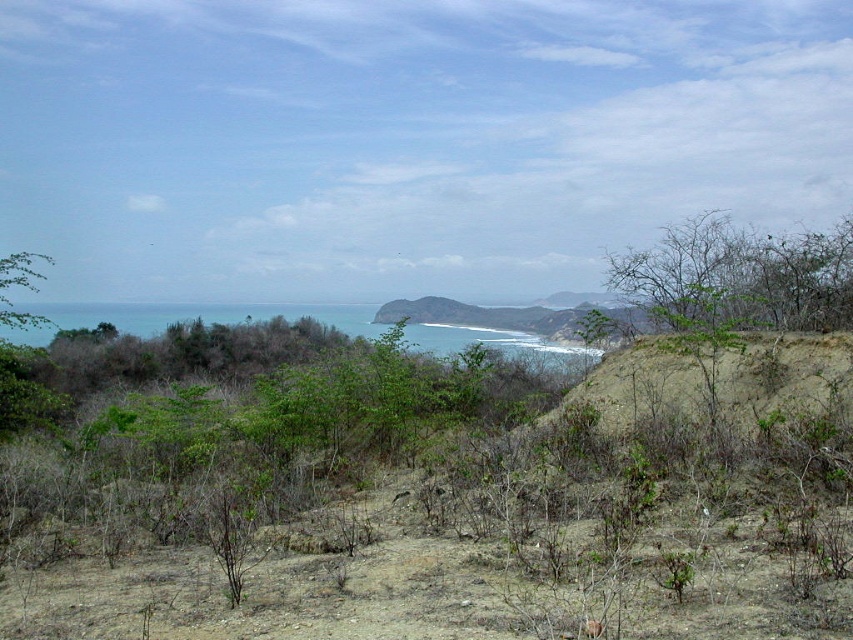
Which is in front, point (143, 333) or point (21, 320)?

Point (21, 320) is in front.

This screenshot has height=640, width=853. What are the coordinates of `blue water at center` in the screenshot? It's located at (189, 317).

You are a GUI agent. You are given a task and a screenshot of the screen. Output one action in this format:
    pyautogui.click(x=<x>, y=<y>)
    Task: Click on the blue water at center
    
    Given the screenshot: What is the action you would take?
    click(189, 317)

Where is `blue water at center`? The width and height of the screenshot is (853, 640). blue water at center is located at coordinates (189, 317).

Measure the distance between point (781,305) and camera.

A distance of 66.78 feet exists between point (781,305) and camera.

Find the location of a particular element. The width and height of the screenshot is (853, 640). green leafy bush at right is located at coordinates (741, 273).

Is green leafy bush at right thinner than green leafy bush at left?

Yes, green leafy bush at right is thinner than green leafy bush at left.

Based on the photo, who is higher up, green leafy bush at right or green leafy bush at left?

green leafy bush at right

Is point (697, 282) less distant than point (20, 380)?

That is False.

The width and height of the screenshot is (853, 640). Identify the location of green leafy bush at right. (741, 273).